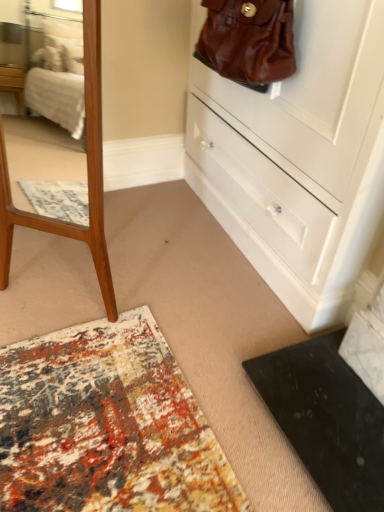
Question: Choose the correct answer: Is brown leather handbag at upper right inside white glossy chest of drawers at upper right or outside it?

Choices:
 (A) inside
 (B) outside

Answer: (A)

Question: Considering the positions of point (230, 10) and point (213, 139), is point (230, 10) closer or farther from the camera than point (213, 139)?

Choices:
 (A) farther
 (B) closer

Answer: (B)

Question: Considering the positions of brown leather handbag at upper right and white glossy chest of drawers at upper right in the image, is brown leather handbag at upper right bigger or smaller than white glossy chest of drawers at upper right?

Choices:
 (A) big
 (B) small

Answer: (B)

Question: Is white glossy chest of drawers at upper right bigger or smaller than brown leather handbag at upper right?

Choices:
 (A) big
 (B) small

Answer: (A)

Question: Considering their positions, is white glossy chest of drawers at upper right located in front of or behind brown leather handbag at upper right?

Choices:
 (A) front
 (B) behind

Answer: (A)

Question: From a real-world perspective, is white glossy chest of drawers at upper right physically located above or below brown leather handbag at upper right?

Choices:
 (A) below
 (B) above

Answer: (A)

Question: In terms of width, does white glossy chest of drawers at upper right look wider or thinner when compared to brown leather handbag at upper right?

Choices:
 (A) thin
 (B) wide

Answer: (B)